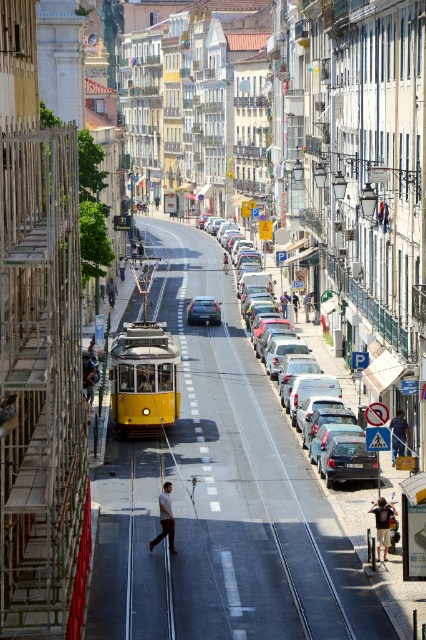
Does dark blue jeans at lower right appear on the left side of light brown leather jacket at center?

Incorrect, dark blue jeans at lower right is not on the left side of light brown leather jacket at center.

Who is more forward, (x=388, y=548) or (x=224, y=268)?

Positioned in front is point (x=388, y=548).

Image resolution: width=426 pixels, height=640 pixels. In order to click on dark blue jeans at lower right in this screenshot , I will do pos(382,524).

Does dark blue jeans at lower right appear on the left side of denim jacket at center?

Incorrect, dark blue jeans at lower right is not on the left side of denim jacket at center.

What do you see at coordinates (382, 524) in the screenshot?
I see `dark blue jeans at lower right` at bounding box center [382, 524].

Is point (382, 509) in front of point (282, 304)?

Yes, it is.

Where is `dark blue jeans at lower right`? Image resolution: width=426 pixels, height=640 pixels. dark blue jeans at lower right is located at coordinates (382, 524).

Is dark blue jeans at center to the left of light brown leather jacket at center from the viewer's perspective?

Indeed, dark blue jeans at center is positioned on the left side of light brown leather jacket at center.

How much distance is there between dark blue jeans at center and light brown leather jacket at center?

They are 15.38 meters apart.

The image size is (426, 640). Describe the element at coordinates (111, 291) in the screenshot. I see `dark blue jeans at center` at that location.

You are a GUI agent. You are given a task and a screenshot of the screen. Output one action in this format:
    pyautogui.click(x=<x>, y=<y>)
    Task: Click on the dark blue jeans at center
    The image size is (426, 640).
    Given the screenshot: What is the action you would take?
    pyautogui.click(x=111, y=291)